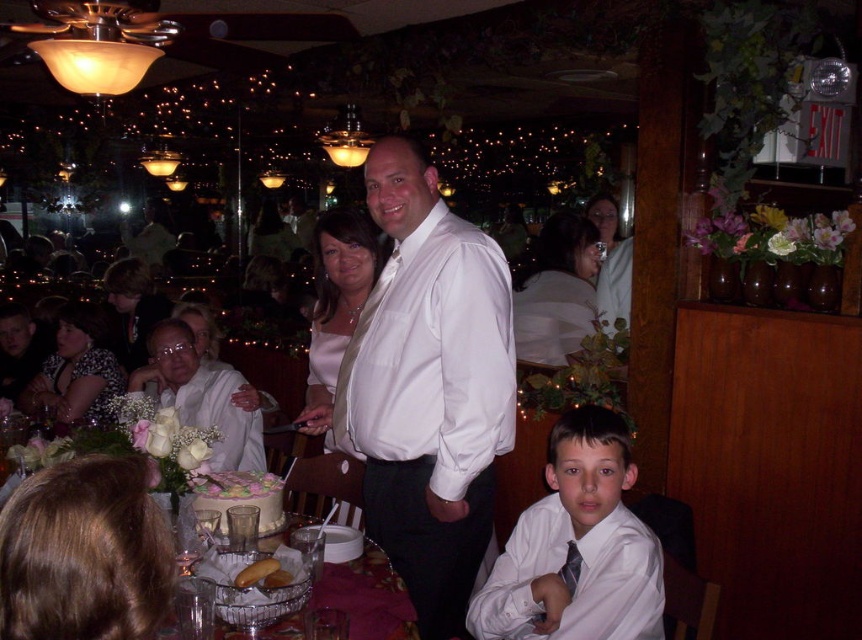
You are a photographer at the event and need to capture a group photo of the two people wearing the matte white blouse at upper center and matte white blouse at upper right. Which person should you position closer to the camera to ensure both appear equally sized in the photo?

Position the matte white blouse at upper right closer to the camera because its actual width is smaller than the matte white blouse at upper center. By placing the smaller one nearer, their apparent sizes in the photo will balance out.

You are a guest at the celebration and want to take a photo of the white frosted cake at center without any obstruction. The metallic silver basket at lower center is blocking your view. How can you adjust your position to capture the cake clearly?

Move behind the metallic silver basket at lower center so that the white frosted cake at center is no longer blocked. Since the metallic silver basket at lower center is in front of the cake, moving behind it will allow you to see the cake clearly.

You are a guest at this event and want to see both the metallic silver basket at lower center and the white frosted cake at center. Which one will you need to look up to see?

You will need to look up to see the white frosted cake at center because it is taller than the metallic silver basket at lower center.